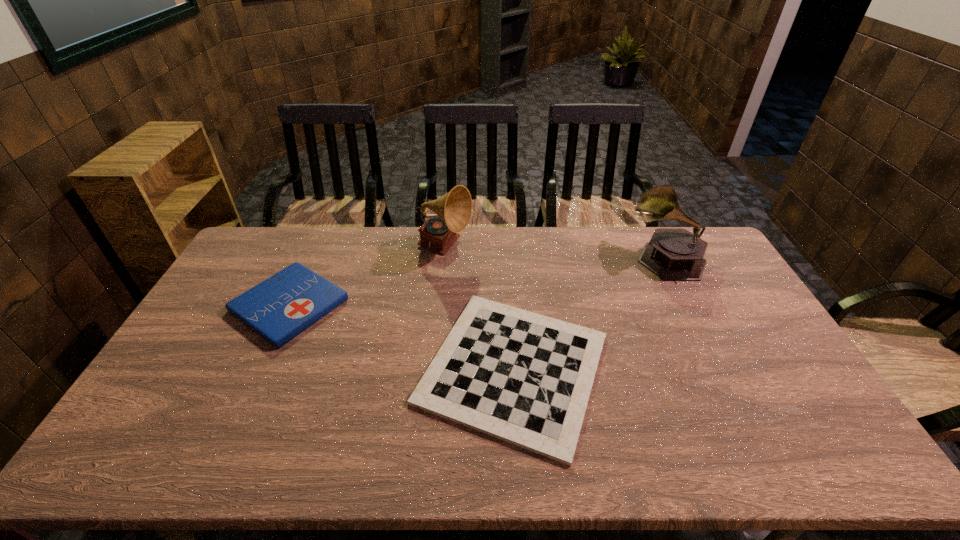
Find the location of a particular element. This screenshot has width=960, height=540. the left phonograph record is located at coordinates (453, 210).

The image size is (960, 540). Find the location of `the right phonograph record`. the right phonograph record is located at coordinates (674, 254).

This screenshot has width=960, height=540. I want to click on the first-aid kit, so click(x=278, y=309).

Find the location of a particular element. the leftmost object is located at coordinates (278, 309).

The image size is (960, 540). I want to click on the shortest object, so click(521, 377).

The width and height of the screenshot is (960, 540). In order to click on free space located 0.310m on the horn of the left phonograph record in this screenshot , I will do `click(555, 248)`.

I want to click on vacant space located on the horn direction of the rightmost object, so click(x=545, y=258).

The width and height of the screenshot is (960, 540). In order to click on vacant space situated on the horn direction of the rightmost object in this screenshot , I will do `click(551, 258)`.

I want to click on free space located on the horn direction of the rightmost object, so click(564, 258).

I want to click on vacant space located 0.160m on the front of the second shortest object, so click(247, 396).